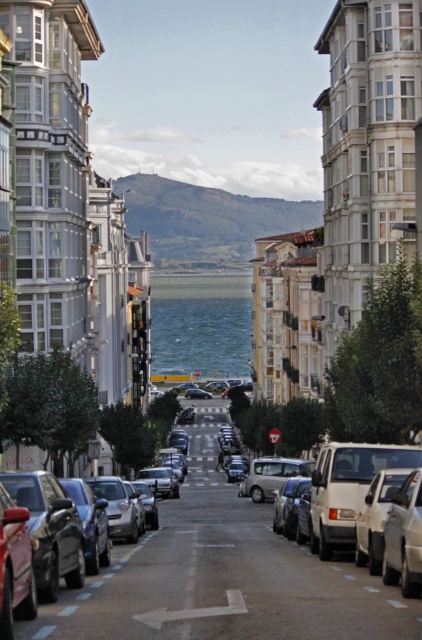
Question: Does clear water at center have a lesser width compared to matte white car at center?

Choices:
 (A) yes
 (B) no

Answer: (B)

Question: Does clear water at center come behind matte white car at center?

Choices:
 (A) no
 (B) yes

Answer: (B)

Question: Which of the following is the closest to the observer?

Choices:
 (A) (345, 513)
 (B) (178, 308)

Answer: (A)

Question: Can you confirm if clear water at center is positioned to the left of matte white car at center?

Choices:
 (A) no
 (B) yes

Answer: (B)

Question: Which point appears farthest from the camera in this image?

Choices:
 (A) pyautogui.click(x=208, y=308)
 (B) pyautogui.click(x=345, y=531)

Answer: (A)